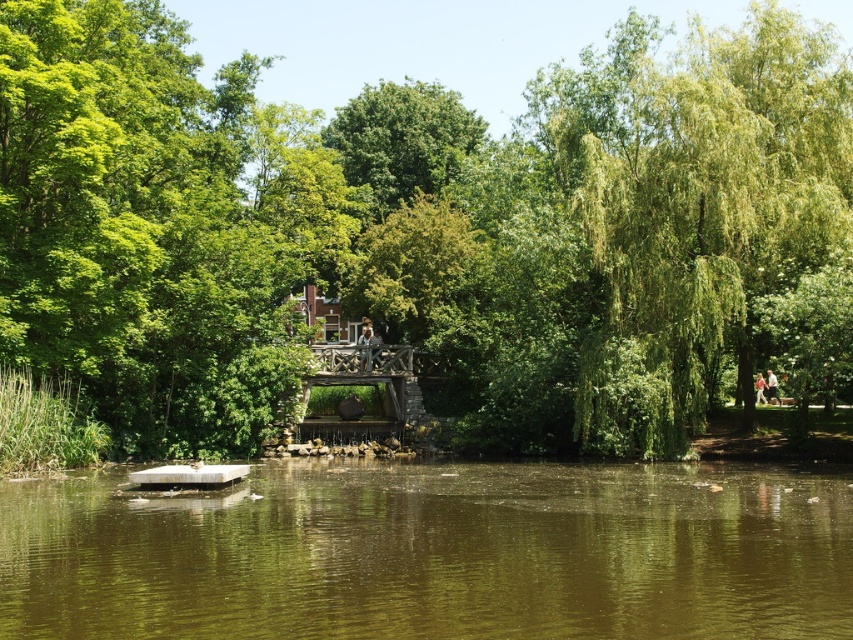
Who is more distant from viewer, (840,160) or (592,472)?

The point (840,160) is behind.

Who is more forward, (125, 253) or (358, 541)?

Point (358, 541) is more forward.

You are a GUI agent. You are given a task and a screenshot of the screen. Output one action in this format:
    pyautogui.click(x=<x>, y=<y>)
    Task: Click on the green leafy tree at center
    This screenshot has height=640, width=853.
    Given the screenshot: What is the action you would take?
    pyautogui.click(x=409, y=225)